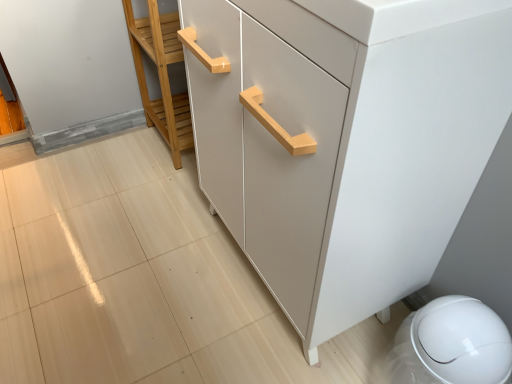
What is the approximate height of matte white cabinet at center?

The height of matte white cabinet at center is 33.43 inches.

Measure the distance between matte white cabinet at center and camera.

matte white cabinet at center is 44.14 centimeters away from camera.

The width and height of the screenshot is (512, 384). Describe the element at coordinates (346, 140) in the screenshot. I see `matte white cabinet at center` at that location.

Locate an element on the screen. The height and width of the screenshot is (384, 512). matte white cabinet at center is located at coordinates (346, 140).

This screenshot has width=512, height=384. I want to click on light wood cabinet handle at center, so click(x=161, y=75).

Measure the distance between point (152, 26) and camera.

They are 1.28 meters apart.

Describe the element at coordinates (161, 75) in the screenshot. The width and height of the screenshot is (512, 384). I see `light wood cabinet handle at center` at that location.

The height and width of the screenshot is (384, 512). In order to click on matte white cabinet at center in this screenshot , I will do `click(346, 140)`.

Which is more to the left, light wood cabinet handle at center or matte white cabinet at center?

Positioned to the left is light wood cabinet handle at center.

Which is in front, light wood cabinet handle at center or matte white cabinet at center?

Positioned in front is matte white cabinet at center.

Considering the points (148, 109) and (458, 63), which point is in front, point (148, 109) or point (458, 63)?

The point (458, 63) is in front.

From the image's perspective, would you say light wood cabinet handle at center is shown under matte white cabinet at center?

Incorrect, from the image's perspective, light wood cabinet handle at center is higher than matte white cabinet at center.

From a real-world perspective, is light wood cabinet handle at center physically located above or below matte white cabinet at center?

light wood cabinet handle at center is below matte white cabinet at center.

Between light wood cabinet handle at center and matte white cabinet at center, which one has larger width?

matte white cabinet at center is wider.

Who is shorter, light wood cabinet handle at center or matte white cabinet at center?

light wood cabinet handle at center is shorter.

Who is smaller, light wood cabinet handle at center or matte white cabinet at center?

Smaller between the two is light wood cabinet handle at center.

Would you say light wood cabinet handle at center contains matte white cabinet at center?

No, matte white cabinet at center is located outside of light wood cabinet handle at center.

Is light wood cabinet handle at center touching matte white cabinet at center?

light wood cabinet handle at center and matte white cabinet at center are not in contact.

Is light wood cabinet handle at center aimed at matte white cabinet at center?

No, light wood cabinet handle at center is not facing towards matte white cabinet at center.

In the scene shown: Measure the distance from light wood cabinet handle at center to matte white cabinet at center.

64.55 centimeters.

Locate an element on the screen. The image size is (512, 384). furniture behind the matte white cabinet at center is located at coordinates (161, 75).

Considering the relative positions of matte white cabinet at center and light wood cabinet handle at center in the image provided, is matte white cabinet at center to the left or to the right of light wood cabinet handle at center?

matte white cabinet at center is positioned on light wood cabinet handle at center's right side.

Does matte white cabinet at center come behind light wood cabinet handle at center?

No.

Is point (446, 104) positioned after point (187, 122)?

No, (446, 104) is closer to viewer.

From the image's perspective, which one is positioned higher, matte white cabinet at center or light wood cabinet handle at center?

light wood cabinet handle at center, from the image's perspective.

From a real-world perspective, is matte white cabinet at center physically above light wood cabinet handle at center?

Indeed, from a real-world perspective, matte white cabinet at center stands above light wood cabinet handle at center.

Between matte white cabinet at center and light wood cabinet handle at center, which one has smaller width?

light wood cabinet handle at center.

Considering the sizes of objects matte white cabinet at center and light wood cabinet handle at center in the image provided, who is shorter, matte white cabinet at center or light wood cabinet handle at center?

light wood cabinet handle at center.

Based on the photo, considering the relative sizes of matte white cabinet at center and light wood cabinet handle at center in the image provided, is matte white cabinet at center bigger than light wood cabinet handle at center?

Yes, matte white cabinet at center is bigger than light wood cabinet handle at center.

Is matte white cabinet at center inside or outside of light wood cabinet handle at center?

matte white cabinet at center is located beyond the bounds of light wood cabinet handle at center.

Are matte white cabinet at center and light wood cabinet handle at center located far from each other?

That's not correct — matte white cabinet at center is a little close to light wood cabinet handle at center.

Is matte white cabinet at center facing away from light wood cabinet handle at center?

No, light wood cabinet handle at center is not at the back of matte white cabinet at center.

What's the angular difference between matte white cabinet at center and light wood cabinet handle at center's facing directions?

0.768 degrees separate the facing orientations of matte white cabinet at center and light wood cabinet handle at center.

Image resolution: width=512 pixels, height=384 pixels. Identify the location of chest of drawers above the light wood cabinet handle at center (from a real-world perspective). (346, 140).

The height and width of the screenshot is (384, 512). I want to click on furniture located above the matte white cabinet at center (from the image's perspective), so click(x=161, y=75).

Locate an element on the screen. furniture on the left of matte white cabinet at center is located at coordinates (161, 75).